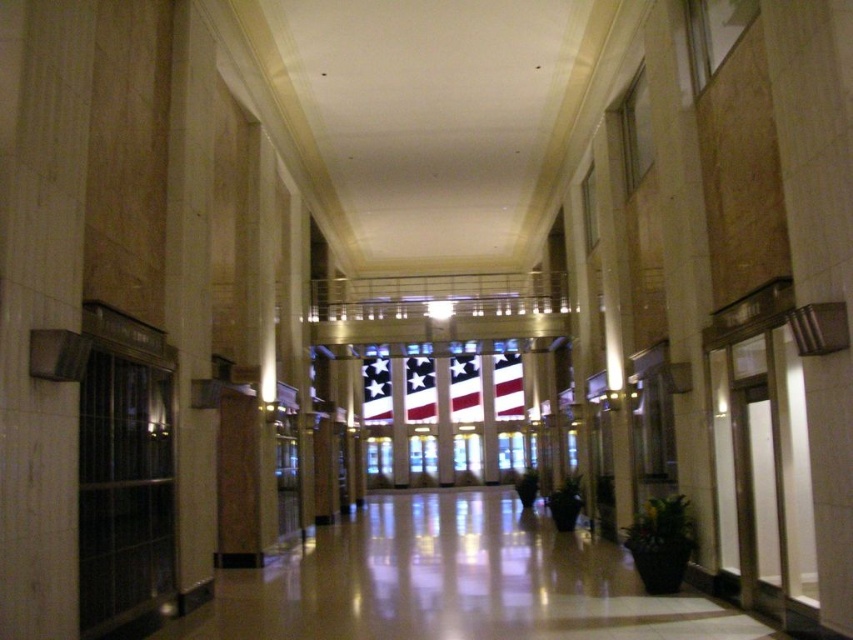
Question: Can you confirm if white glossy floor at center is positioned above white fabric flag at center?

Choices:
 (A) no
 (B) yes

Answer: (A)

Question: Does white glossy floor at center lie in front of white fabric flag at center?

Choices:
 (A) yes
 (B) no

Answer: (A)

Question: Is white glossy floor at center thinner than white fabric flag at center?

Choices:
 (A) yes
 (B) no

Answer: (A)

Question: Which point is farther to the camera?

Choices:
 (A) (466, 410)
 (B) (579, 538)

Answer: (A)